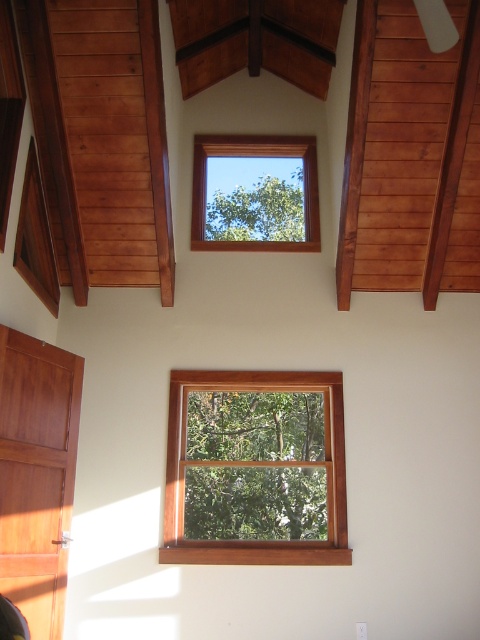
Question: Is wooden frame at center positioned in front of clear glass window at upper center?

Choices:
 (A) no
 (B) yes

Answer: (B)

Question: Can you confirm if wooden frame at center is positioned to the left of clear glass window at upper center?

Choices:
 (A) yes
 (B) no

Answer: (A)

Question: Which point is farther to the camera?

Choices:
 (A) wooden frame at center
 (B) clear glass window at upper center

Answer: (B)

Question: Is wooden frame at center positioned in front of clear glass window at upper center?

Choices:
 (A) yes
 (B) no

Answer: (A)

Question: Which object appears farthest from the camera in this image?

Choices:
 (A) wooden frame at center
 (B) clear glass window at upper center

Answer: (B)

Question: Which of the following is the farthest from the observer?

Choices:
 (A) clear glass window at upper center
 (B) wooden frame at center

Answer: (A)